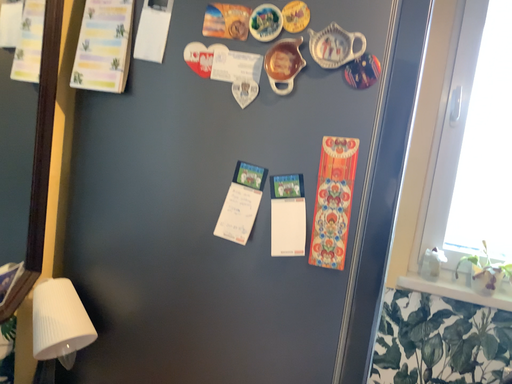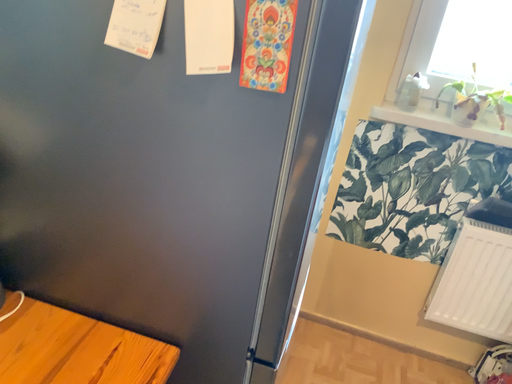
Question: Which way did the camera rotate in the video?

Choices:
 (A) rotated downward
 (B) rotated upward

Answer: (A)